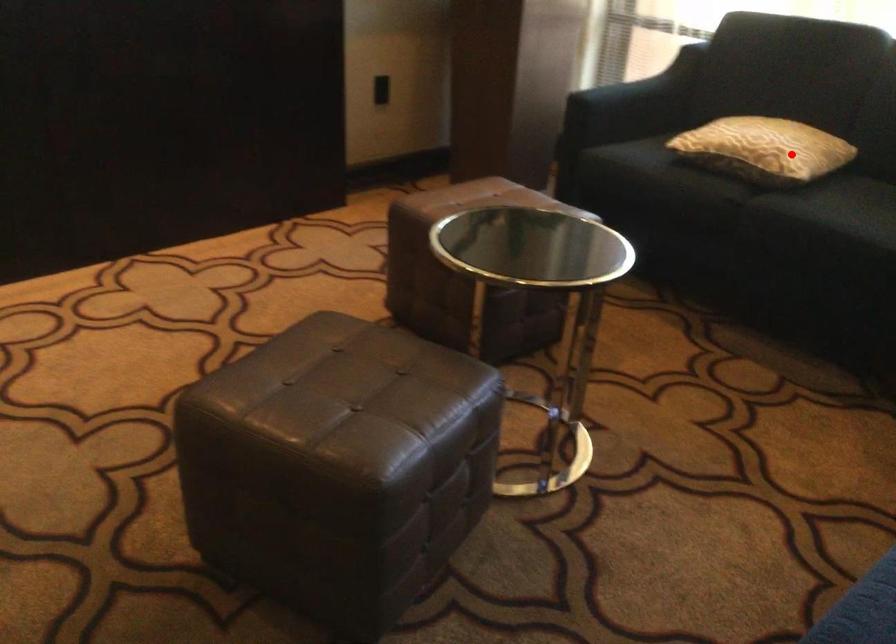
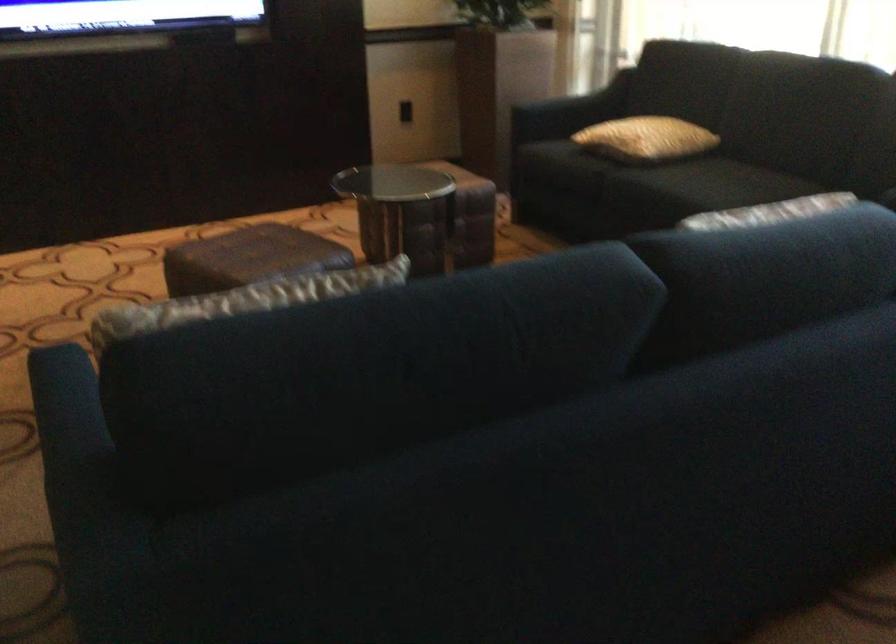
Question: I am providing you with two images of the same scene from different viewpoints. Given a red point in image1, look at the same physical point in image2. Is it:

Choices:
 (A) Closer to the viewpoint
 (B) Farther from the viewpoint

Answer: (B)